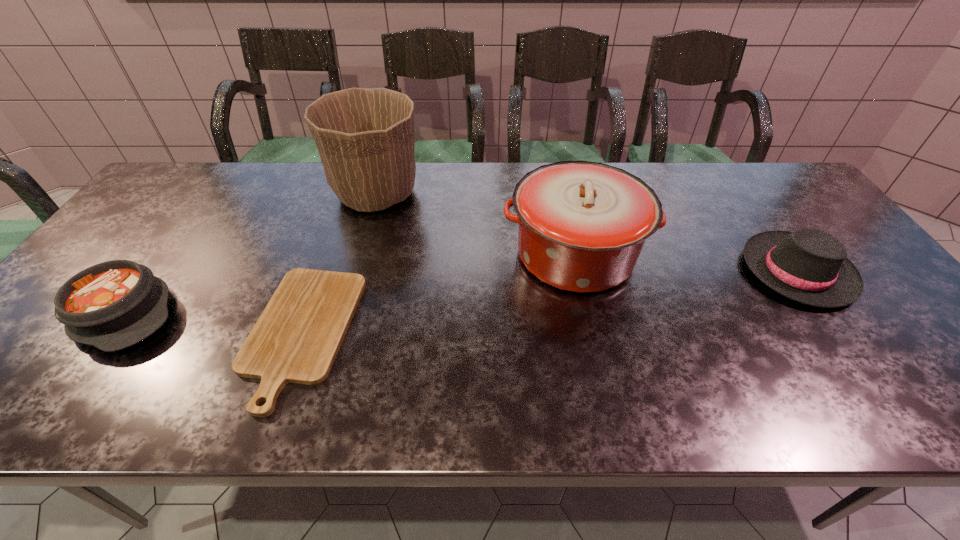
What are the coordinates of `vacant space that satisfies the following two spatial constraints: 1. on the back side of the fourth shortest object; 2. on the left side of the shortest object` in the screenshot? It's located at (329, 254).